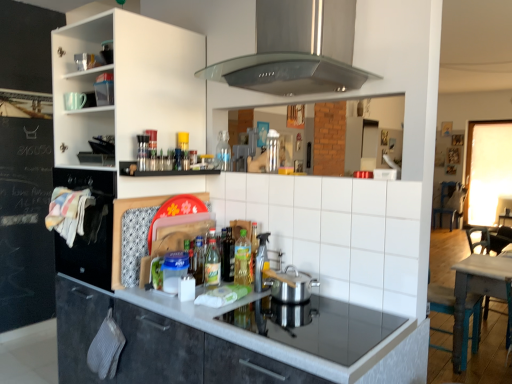
This screenshot has width=512, height=384. I want to click on free location to the right of translucent plastic bottle at center, acting as the first bottle starting from the bottom, so click(241, 290).